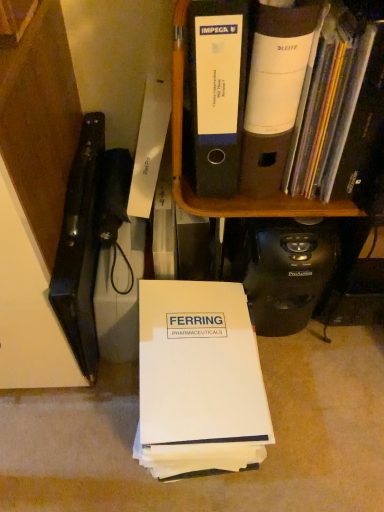
Question: From the image's perspective, is white paper at center, which appears as the 1th book when ordered from the bottom, on top of black plastic file folders at upper center?

Choices:
 (A) no
 (B) yes

Answer: (A)

Question: Is white paper at center, which appears as the 1th book when ordered from the bottom, shorter than black plastic file folders at upper center?

Choices:
 (A) no
 (B) yes

Answer: (B)

Question: Is white paper at center, which appears as the 2th book when viewed from the top, oriented towards black plastic file folders at upper center?

Choices:
 (A) no
 (B) yes

Answer: (A)

Question: Can you confirm if white paper at center, which ranks as the 1th book in left-to-right order, is positioned to the left of black plastic file folders at upper center?

Choices:
 (A) yes
 (B) no

Answer: (A)

Question: Is white paper at center, which ranks as the 1th book in left-to-right order, wider than black plastic file folders at upper center?

Choices:
 (A) yes
 (B) no

Answer: (A)

Question: Considering the relative sizes of black plastic file folders at upper center and white paper at center, which appears as the 2th book when viewed from the top, in the image provided, is black plastic file folders at upper center taller than white paper at center, which appears as the 2th book when viewed from the top,?

Choices:
 (A) yes
 (B) no

Answer: (A)

Question: Is black plastic file folders at upper center wider than white paper at center, which ranks as the 1th book in left-to-right order?

Choices:
 (A) yes
 (B) no

Answer: (B)

Question: From a real-world perspective, is black plastic file folders at upper center on top of white paper at center, which ranks as the 1th book in left-to-right order?

Choices:
 (A) no
 (B) yes

Answer: (B)

Question: Is black plastic file folders at upper center closer to camera compared to white paper at center, which appears as the 1th book when ordered from the bottom?

Choices:
 (A) no
 (B) yes

Answer: (B)

Question: Does black plastic file folders at upper center appear on the right side of white paper at center, the second book in the right-to-left sequence?

Choices:
 (A) no
 (B) yes

Answer: (B)

Question: Could white paper at center, which appears as the 2th book when viewed from the top, be considered to be inside black plastic file folders at upper center?

Choices:
 (A) no
 (B) yes

Answer: (A)

Question: From a real-world perspective, is white matte folder at upper right, the second book positioned from the left, below white paper at center, which ranks as the 1th book in left-to-right order?

Choices:
 (A) no
 (B) yes

Answer: (A)